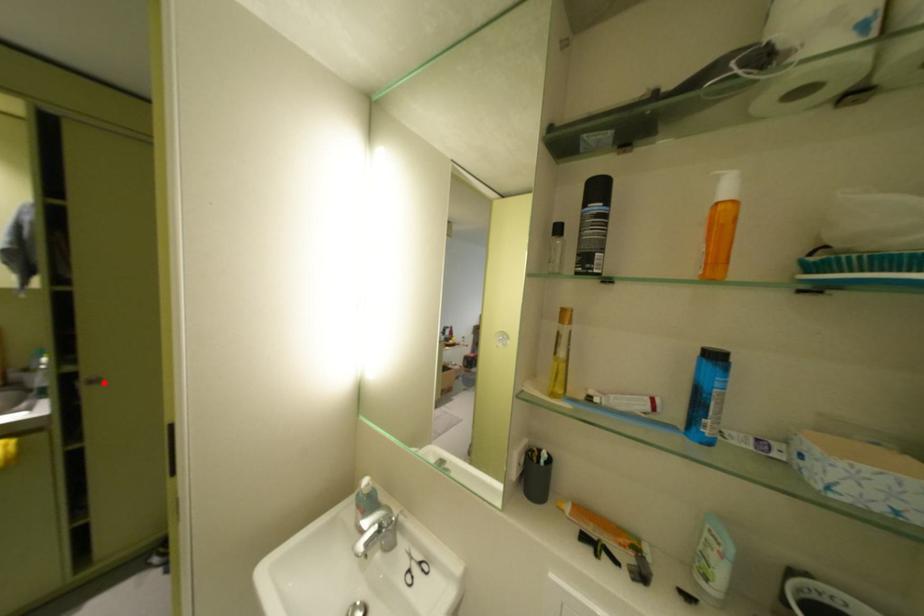
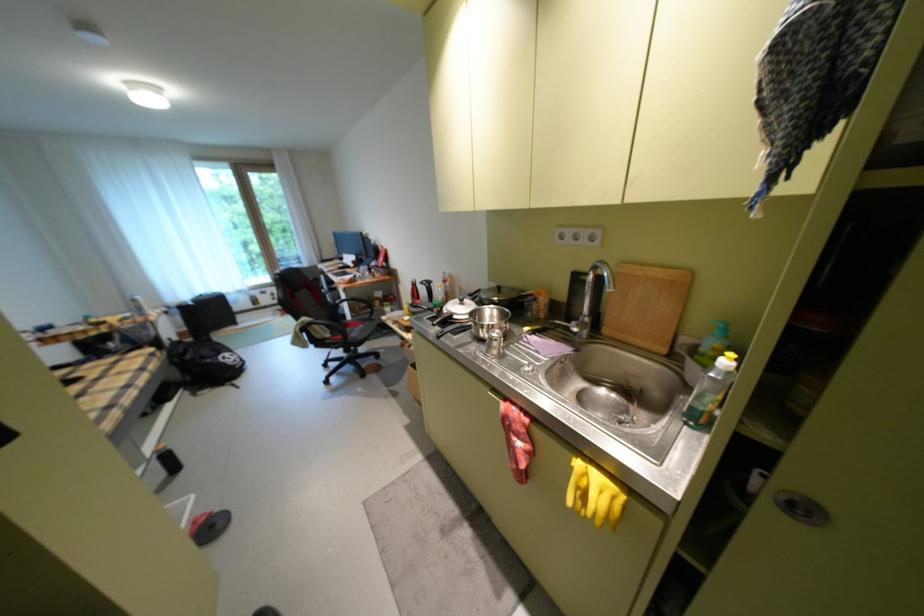
In the second image, find the point that corresponds to the highlighted location in the first image.

(811, 511)